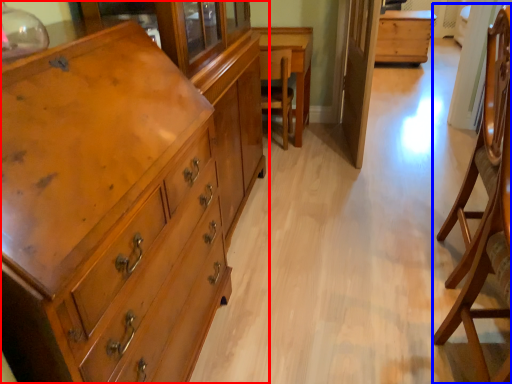
Question: Which point is closer to the camera, chest of drawers (highlighted by a red box) or armchair (highlighted by a blue box)?

Choices:
 (A) chest of drawers
 (B) armchair

Answer: (A)